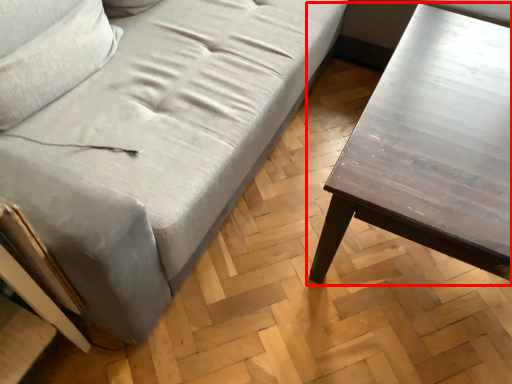
Question: Observing the image, what is the correct spatial positioning of table (annotated by the red box) in reference to studio couch?

Choices:
 (A) left
 (B) right

Answer: (B)